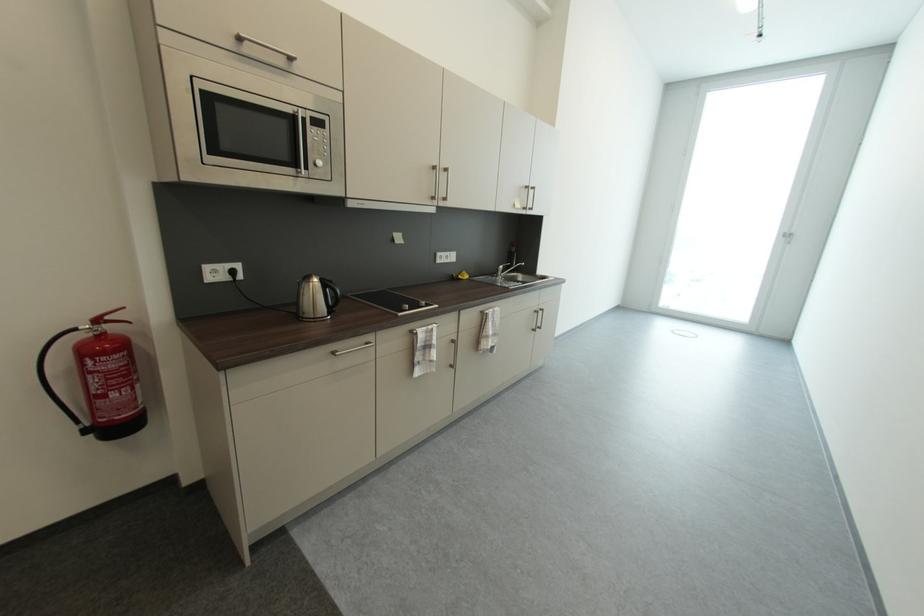
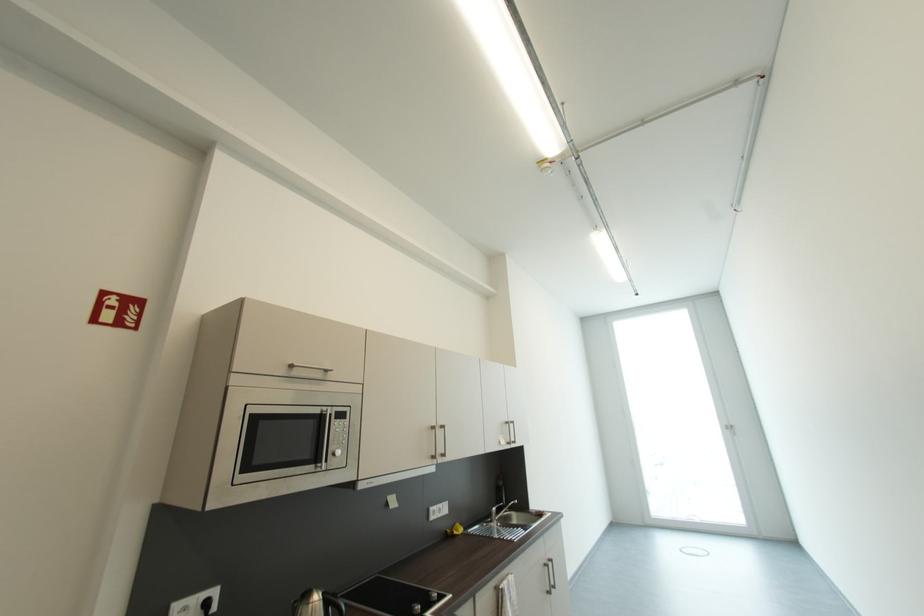
Find the pixel in the second image that matches pixel 297 113 in the first image.

(325, 413)